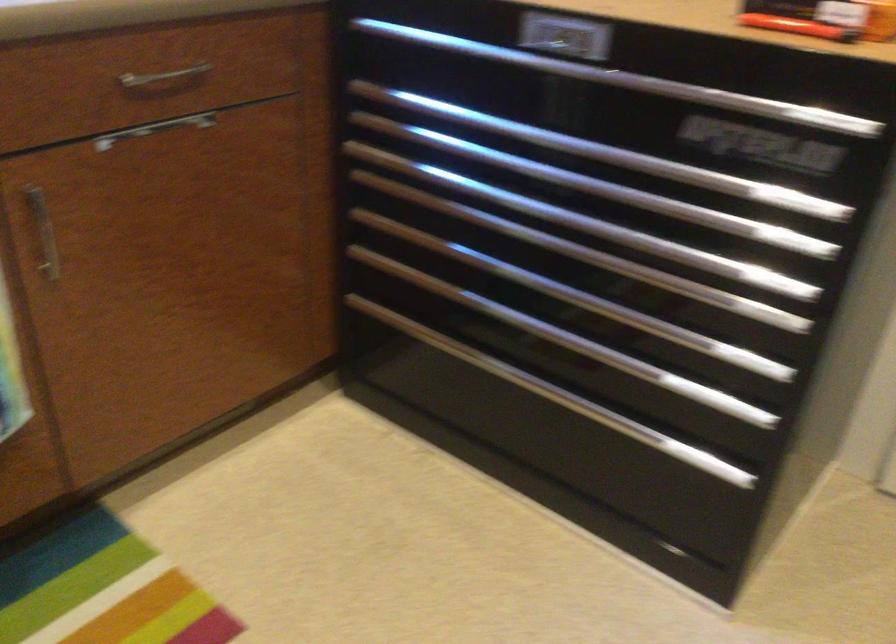
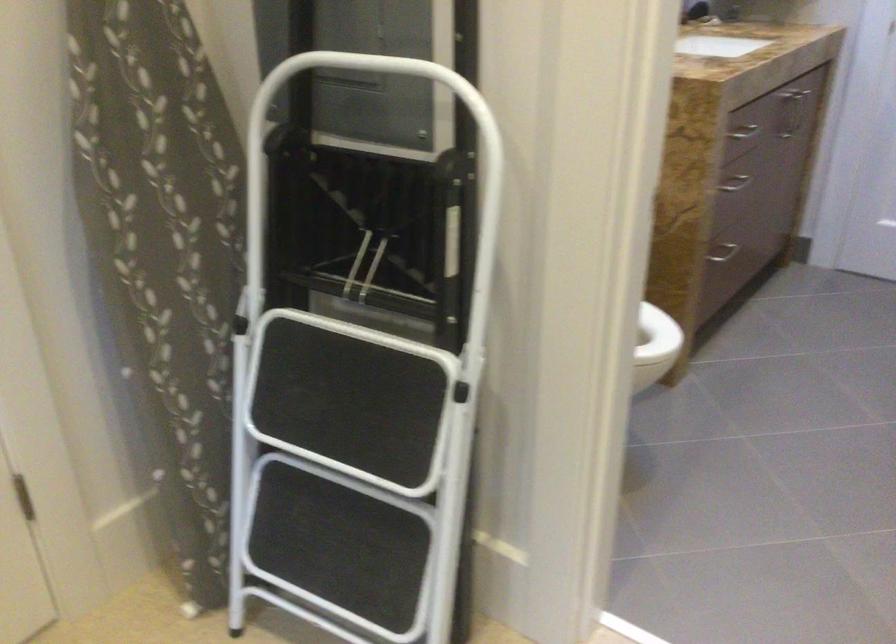
Based on the continuous images, in which direction is the camera rotating?

The camera's rotation is toward right-down.